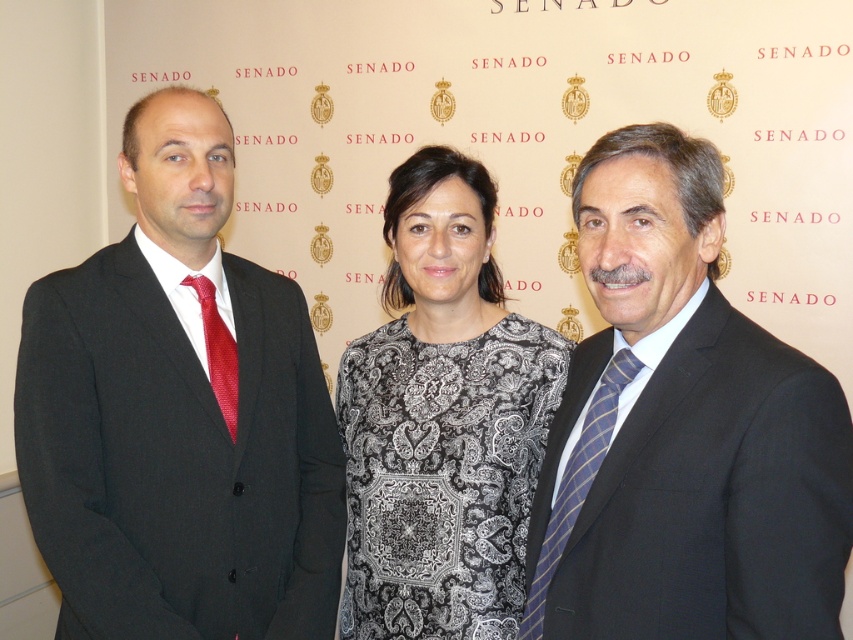
You are organizing a photo shoot and need to ensure that all attire details are properly framed. Given the presence of the matte black suit at right and the blue striped tie at right, which item requires more space in the camera frame to capture its full detail?

The matte black suit at right requires more space in the camera frame to capture its full detail because it has a larger size compared to the blue striped tie at right.

You are a photographer setting up for a group photo. You need to ensure that the blue striped tie at right and the shiny red tie at left are at least 24 inches apart for better visibility. Based on the scene description, will their current positions meet this requirement?

The blue striped tie at right and the shiny red tie at left are currently 23.74 inches apart, which is slightly less than the required 24 inches. To meet the requirement, they need to move approximately 0.26 inches further apart.

You are a photographer setting up a shoot with the backdrop featuring the word SENADO. You notice two ties in the scene, the blue striped tie at right and the shiny red tie at left. Which tie is located lower in the image?

The blue striped tie at right is positioned under the shiny red tie at left, so the blue striped tie at right is lower in the image.